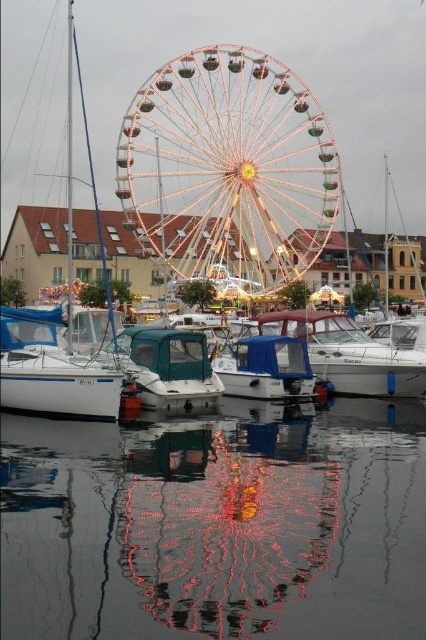
You are standing on the dock and want to board the white plastic boat at center. The safety regulations state that you must stay at least 50 meters away from any large structures like the Ferris wheel. Is your current position safe?

The distance between you and the Ferris wheel is 76.25 meters, which is more than the required 50 meters. Therefore, your current position is safe.

From the picture: You are standing at the edge of the marina and see the teal matte boat at center and the white glossy boat at center. Which boat is closer to you?

The teal matte boat at center is positioned over the white glossy boat at center, meaning it is closer to you.

You are standing at the edge of the marina and want to board the white plastic boat at center. Based on its position, which direction should you walk to reach it?

The white plastic boat at center is located at point (51, 369), so you should walk towards the center of the marina to reach it.